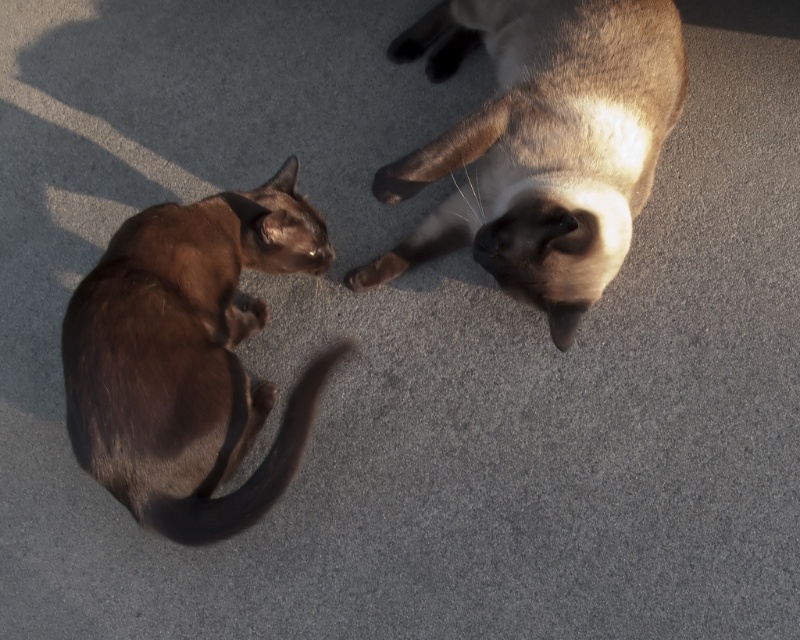
Does satin brown cat at upper right appear on the right side of brown fur cat at left?

Indeed, satin brown cat at upper right is positioned on the right side of brown fur cat at left.

Is point (458, 13) closer to viewer compared to point (225, 380)?

That is False.

Is point (558, 218) positioned in front of point (154, 365)?

No, (558, 218) is behind (154, 365).

Where is `satin brown cat at upper right`? Image resolution: width=800 pixels, height=640 pixels. satin brown cat at upper right is located at coordinates (541, 145).